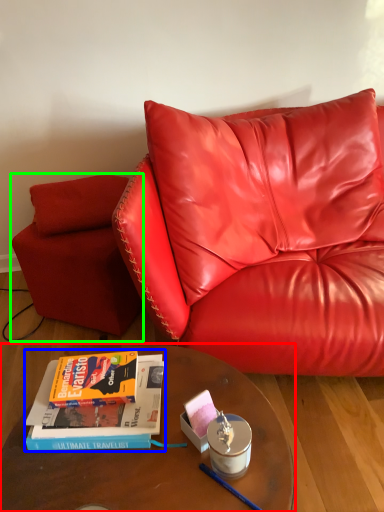
Question: Considering the real-world distances, which object is farthest from table (highlighted by a red box)? book (highlighted by a blue box) or armchair (highlighted by a green box)?

Choices:
 (A) book
 (B) armchair

Answer: (B)